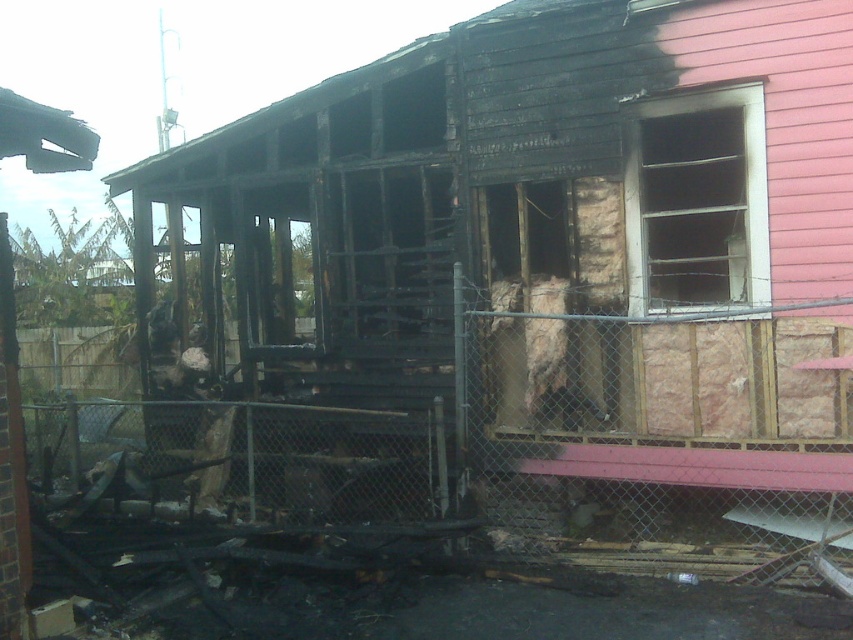
Question: Which point is farther to the camera?

Choices:
 (A) (747, 550)
 (B) (761, 323)

Answer: (B)

Question: In this image, where is rusty chain-link fence at center located relative to metal chain-link fence at center?

Choices:
 (A) left
 (B) right

Answer: (A)

Question: Can you confirm if rusty chain-link fence at center is positioned below metal chain-link fence at center?

Choices:
 (A) yes
 (B) no

Answer: (B)

Question: Which point is closer to the camera taking this photo?

Choices:
 (A) (602, 524)
 (B) (619, 554)

Answer: (B)

Question: Which object is farther from the camera taking this photo?

Choices:
 (A) metal chain-link fence at center
 (B) rusty chain-link fence at center

Answer: (B)

Question: Can you confirm if rusty chain-link fence at center is smaller than metal chain-link fence at center?

Choices:
 (A) yes
 (B) no

Answer: (B)